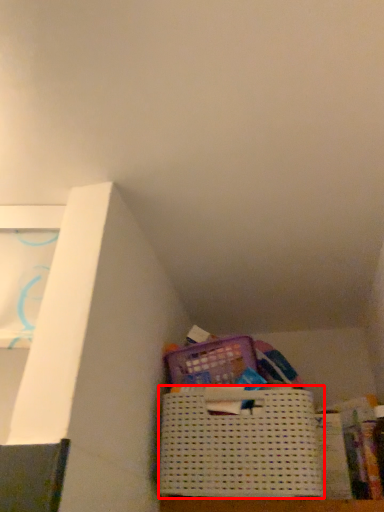
Question: From the image's perspective, considering the relative positions of basket (annotated by the red box) and paperback book in the image provided, where is basket (annotated by the red box) located with respect to the staircase?

Choices:
 (A) above
 (B) below

Answer: (A)